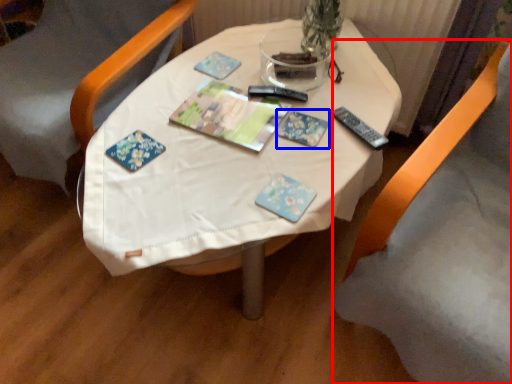
Question: Among these objects, which one is farthest to the camera, chair (highlighted by a red box) or paperback book (highlighted by a blue box)?

Choices:
 (A) chair
 (B) paperback book

Answer: (B)